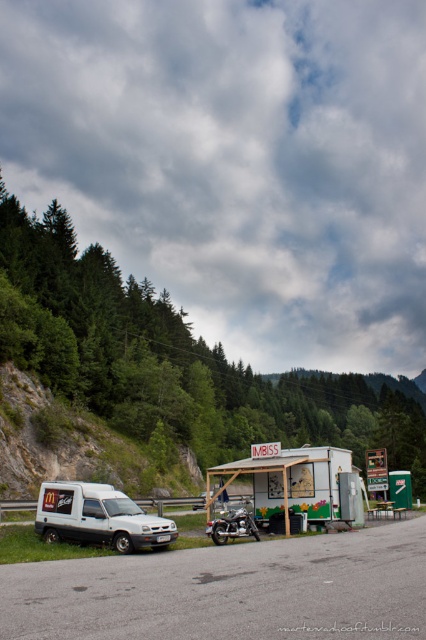
Does green painted wood food stall at center appear over shiny chrome motorcycle at center?

Correct, green painted wood food stall at center is located above shiny chrome motorcycle at center.

Describe the element at coordinates (296, 481) in the screenshot. I see `green painted wood food stall at center` at that location.

Between point (259, 499) and point (224, 534), which one is positioned behind?

Positioned behind is point (259, 499).

The width and height of the screenshot is (426, 640). Identify the location of green painted wood food stall at center. (296, 481).

Can you confirm if white matte van at lower left is bigger than white matte van at center?

No.

Is point (58, 502) positioned behind point (204, 499)?

No, (58, 502) is in front of (204, 499).

Between point (51, 506) and point (195, 504), which one is positioned behind?

Positioned behind is point (195, 504).

Where is `white matte van at lower left`? The width and height of the screenshot is (426, 640). white matte van at lower left is located at coordinates (97, 516).

Between gray asphalt road at center and white matte van at center, which one has more height?

With more height is white matte van at center.

Can you confirm if gray asphalt road at center is positioned to the left of white matte van at center?

Incorrect, gray asphalt road at center is not on the left side of white matte van at center.

Where is `gray asphalt road at center`? The image size is (426, 640). gray asphalt road at center is located at coordinates (230, 589).

Locate an element on the screen. Image resolution: width=426 pixels, height=640 pixels. gray asphalt road at center is located at coordinates (230, 589).